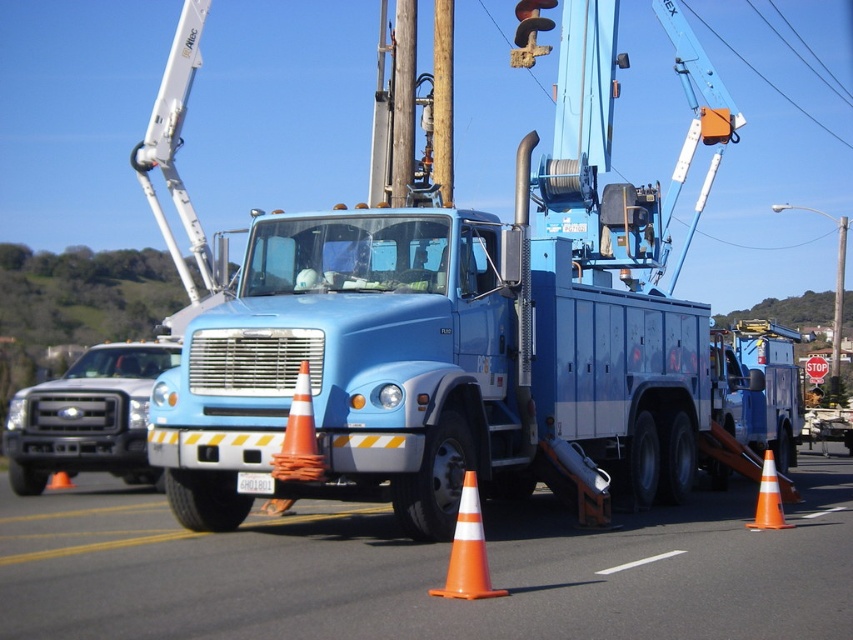
Is orange/cone at lower center to the right of brushed metal telegraph pole at center from the viewer's perspective?

Incorrect, orange/cone at lower center is not on the right side of brushed metal telegraph pole at center.

Does orange/cone at lower center have a smaller size compared to brushed metal telegraph pole at center?

Indeed, orange/cone at lower center has a smaller size compared to brushed metal telegraph pole at center.

Which is behind, point (462, 554) or point (838, 337)?

The point (838, 337) is behind.

Identify the location of orange/cone at lower center. (468, 550).

Is blue metallic utility truck at center taller than orange/cone at center?

Yes, blue metallic utility truck at center is taller than orange/cone at center.

Is blue metallic utility truck at center bigger than orange/cone at center?

Indeed, blue metallic utility truck at center has a larger size compared to orange/cone at center.

Does point (459, 369) come behind point (767, 492)?

No, it is in front of (767, 492).

Where is `blue metallic utility truck at center`? The image size is (853, 640). blue metallic utility truck at center is located at coordinates (453, 340).

Which is above, brushed metal truck at left or orange/cone at lower center?

brushed metal truck at left is higher up.

Is point (15, 484) closer to viewer compared to point (473, 484)?

That is False.

Measure the distance between point [15,420] and camera.

Point [15,420] and camera are 11.64 meters apart from each other.

Identify the location of brushed metal truck at left. This screenshot has width=853, height=640. (86, 417).